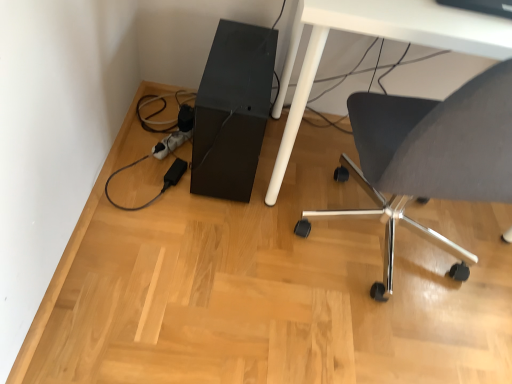
Where is `unoccupied area in front of white glossy table at lower right`? The height and width of the screenshot is (384, 512). unoccupied area in front of white glossy table at lower right is located at coordinates (317, 321).